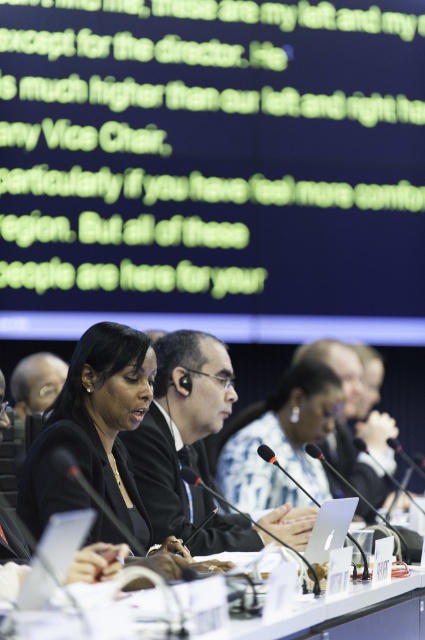
Is black glossy hair at center positioned before white plastic table at center?

No, black glossy hair at center is further to the viewer.

Who is shorter, black glossy hair at center or white plastic table at center?

white plastic table at center is shorter.

Is point (45, 442) farther from viewer compared to point (306, 632)?

Yes, it is behind point (306, 632).

At what (x,y) coordinates should I click in order to perform the action: click on black glossy hair at center. Please return your answer as a coordinate pair (x, y). The image size is (425, 640). Looking at the image, I should click on (93, 429).